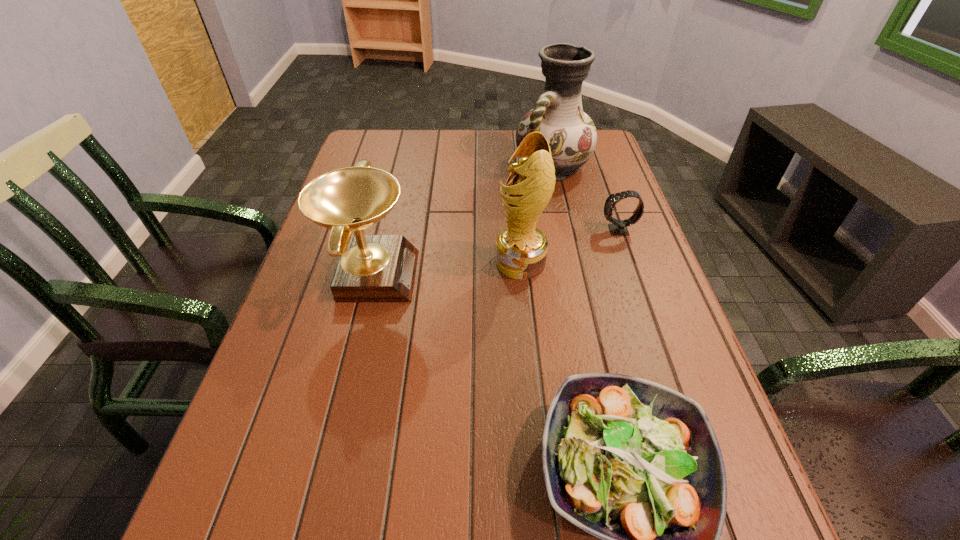
This screenshot has width=960, height=540. In the image, there is a desktop. In order to click on vacant space at the right edge in this screenshot , I will do `click(671, 333)`.

I want to click on vacant region at the far left corner of the desktop, so (363, 142).

Where is `empty space that is in between the watch and the taller award`? The height and width of the screenshot is (540, 960). empty space that is in between the watch and the taller award is located at coordinates (569, 246).

The width and height of the screenshot is (960, 540). I want to click on free space that is in between the right award and the leftmost object, so click(x=445, y=268).

Identify the location of vacant area between the third shortest object and the watch. (494, 252).

Identify the location of free space between the watch and the vase. (586, 198).

I want to click on free space between the watch and the vase, so click(x=586, y=198).

Locate an element on the screen. This screenshot has width=960, height=540. object that stands as the closest to the right award is located at coordinates (618, 227).

Select which object appears as the fourth closest to the watch. Please provide its 2D coordinates. Your answer should be formatted as a tuple, i.e. [(x, y)], where the tuple contains the x and y coordinates of a point satisfying the conditions above.

[(371, 268)]

Locate an element on the screen. This screenshot has width=960, height=540. free space that satisfies the following two spatial constraints: 1. on the front side of the farthest object; 2. on the front-facing side of the left award is located at coordinates (576, 274).